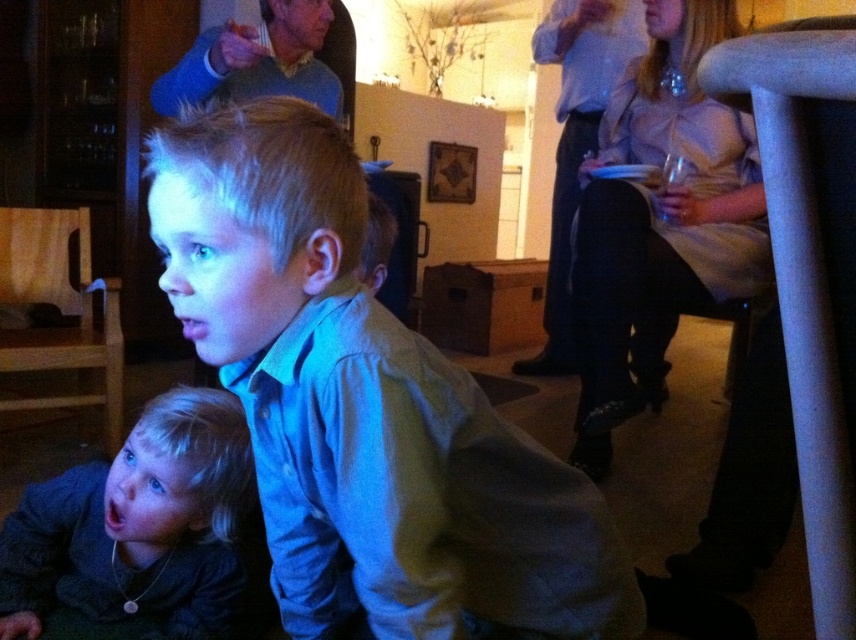
You are a photographer at a party and want to take a photo of the silky beige dress at upper right and the blue sweater at upper center. Which one is more to the right?

The silky beige dress at upper right is more to the right because it is positioned on the right side of blue sweater at upper center.